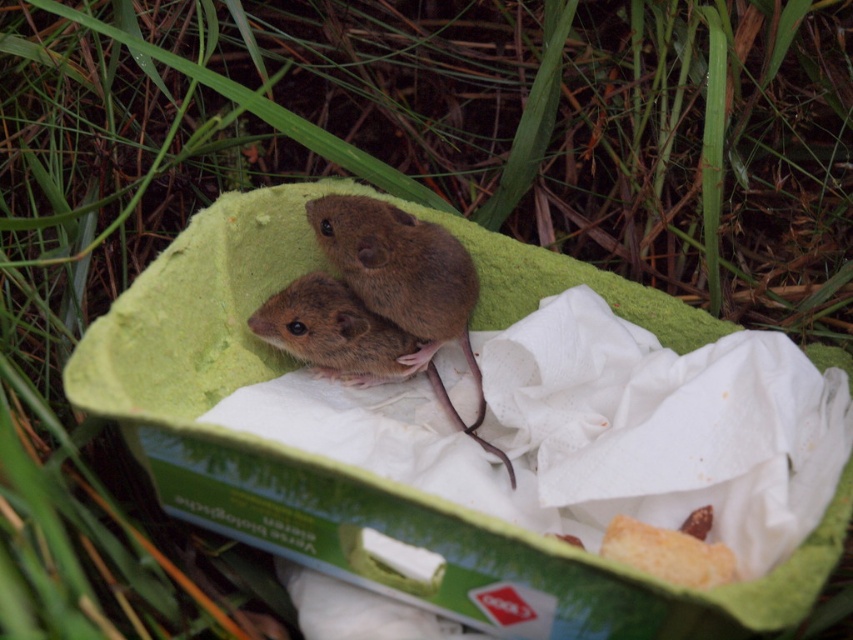
Question: Among these objects, which one is nearest to the camera?

Choices:
 (A) brown furry hamster at center
 (B) brown furry mouse at center

Answer: (A)

Question: Does brown furry hamster at center appear over brown furry mouse at center?

Choices:
 (A) yes
 (B) no

Answer: (A)

Question: Which of the following is the closest to the observer?

Choices:
 (A) (318, 355)
 (B) (355, 291)

Answer: (A)

Question: Is brown furry hamster at center thinner than brown furry mouse at center?

Choices:
 (A) yes
 (B) no

Answer: (B)

Question: Is brown furry hamster at center bigger than brown furry mouse at center?

Choices:
 (A) yes
 (B) no

Answer: (A)